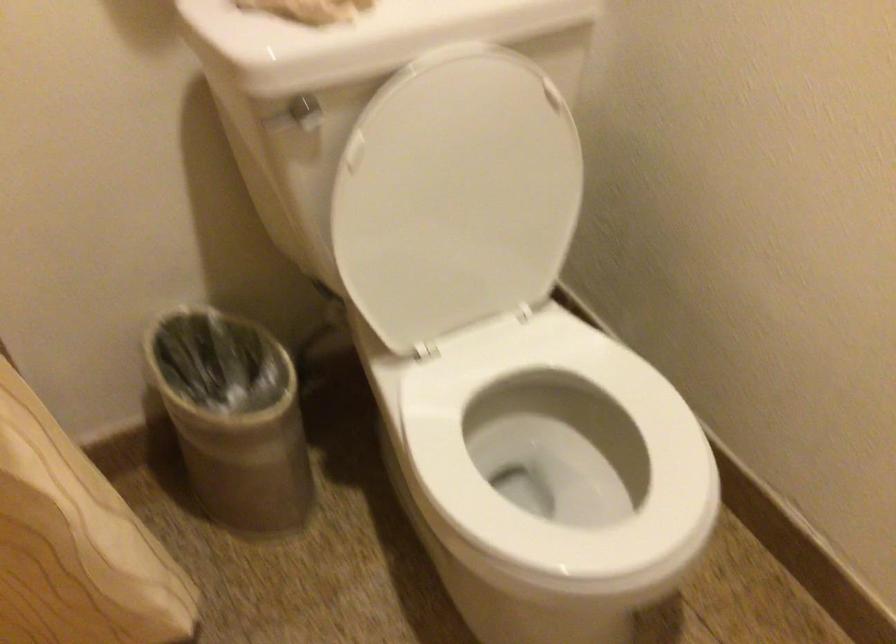
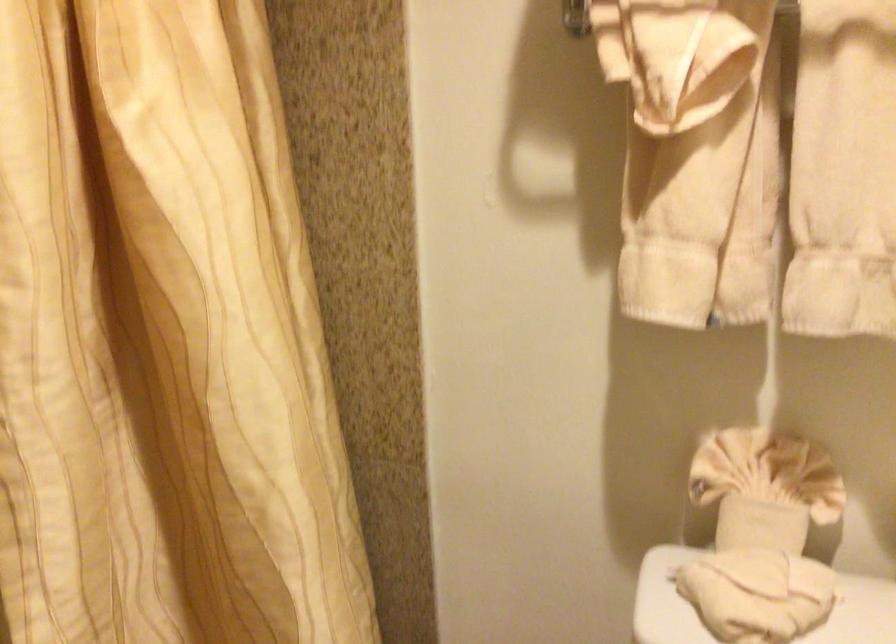
Question: Based on the continuous images, in which direction is the camera rotating? Reply with the corresponding letter.

Choices:
 (A) Left
 (B) Right
 (C) Up
 (D) Down

Answer: (A)